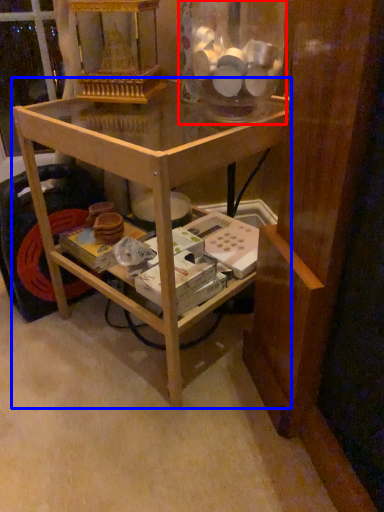
Question: Which object is further to the camera taking this photo, glass jar (highlighted by a red box) or table (highlighted by a blue box)?

Choices:
 (A) glass jar
 (B) table

Answer: (A)